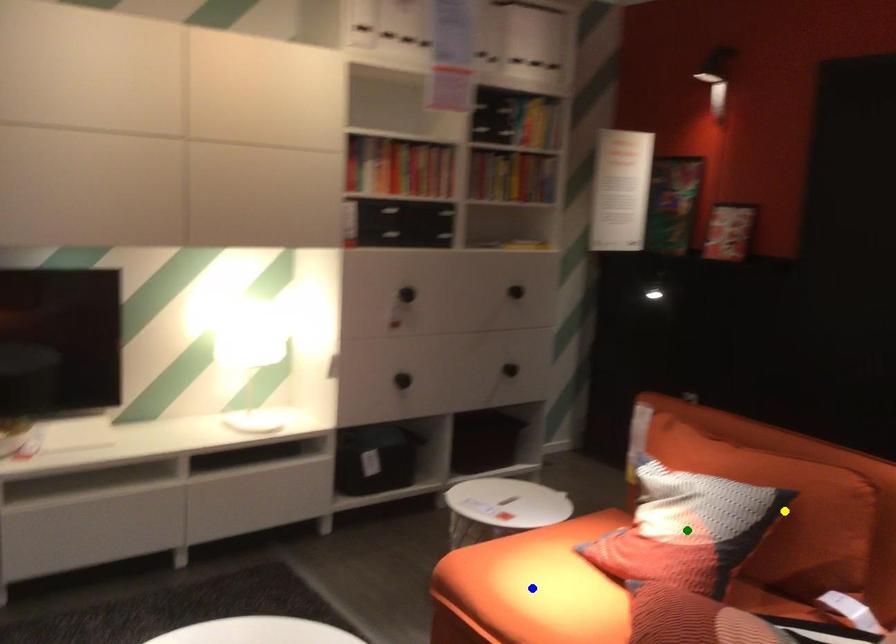
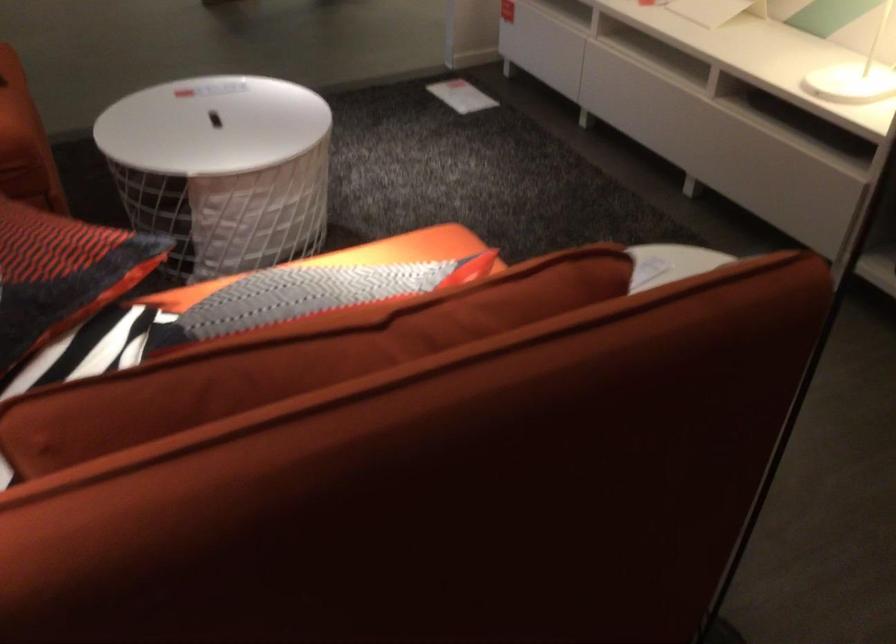
I am providing you with two images of the same scene from different viewpoints. Three points are marked in image1. Which point corresponds to a part or object that is occluded in image2?In image1, three points are marked. Which of them correspond to a part or object that is occluded in image2?Among the three points shown in image1, which one corresponds to a part or object that is no longer visible due to occlusion in image2?

Invisible in image2: yellow point, green point, blue point.